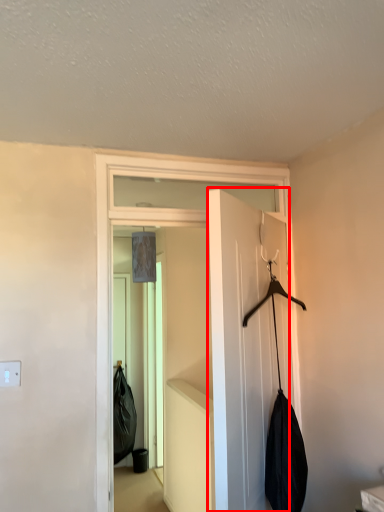
Question: Considering the relative positions of door (annotated by the red box) and door in the image provided, where is door (annotated by the red box) located with respect to the staircase?

Choices:
 (A) left
 (B) right

Answer: (B)